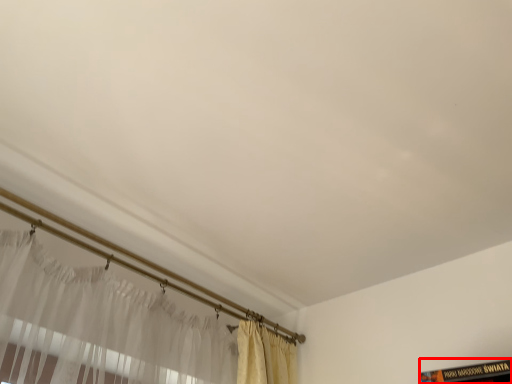
Question: From the image, what is the correct spatial relationship of book (annotated by the red box) in relation to curtain?

Choices:
 (A) right
 (B) left

Answer: (A)